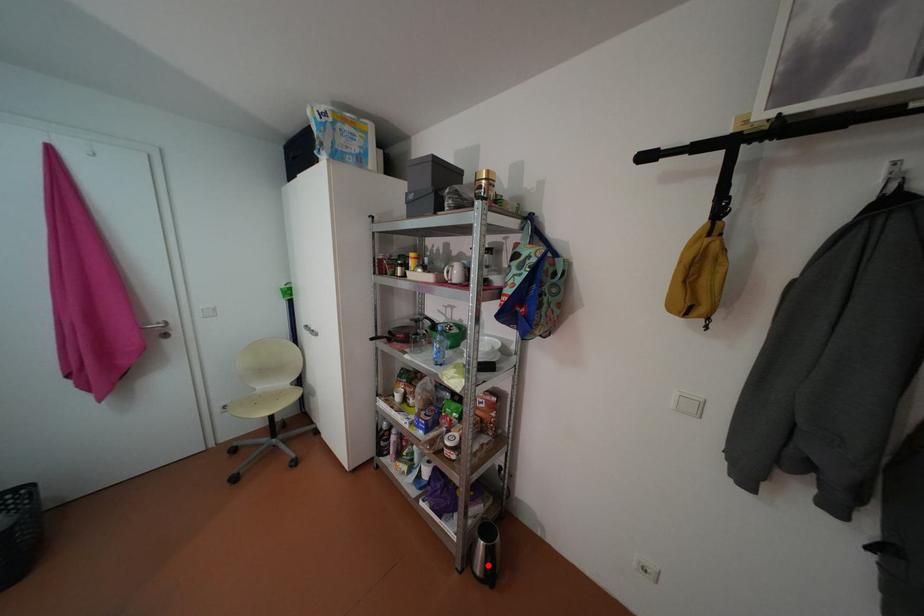
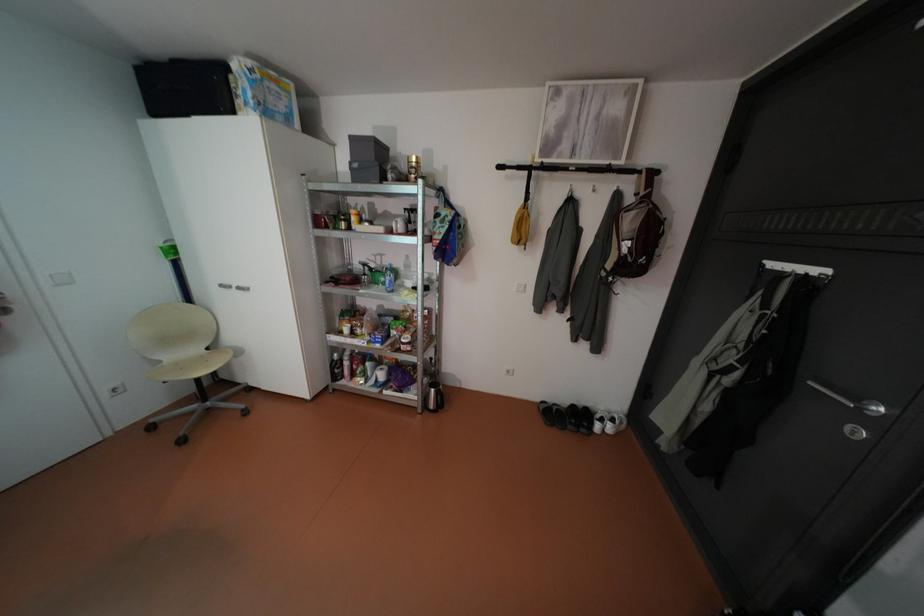
Question: A red point is marked in image1. In image2, is the corresponding 3D point closer to the camera or farther? Reply with the corresponding letter.

Choices:
 (A) The corresponding 3D point is closer.
 (B) The corresponding 3D point is farther.

Answer: (A)